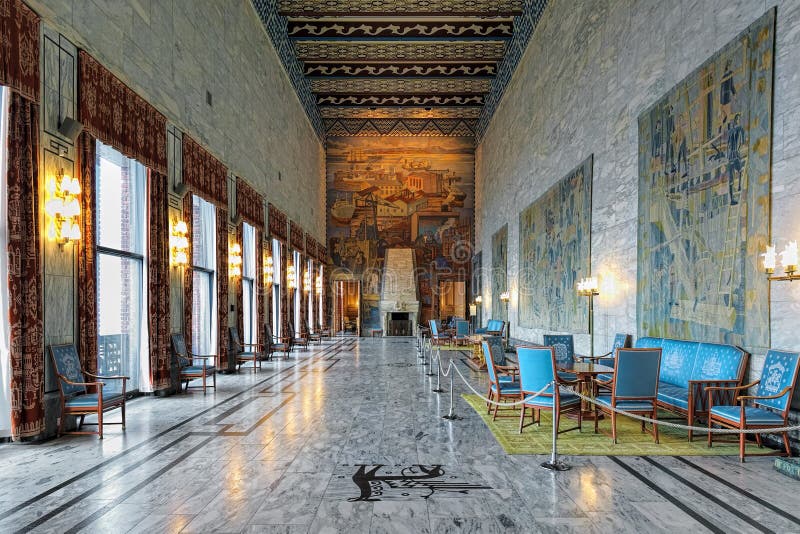
Where is `blue upholstered wood chairs`? The image size is (800, 534). blue upholstered wood chairs is located at coordinates (97, 406), (185, 366), (245, 345), (277, 341), (298, 335), (316, 331), (326, 329).